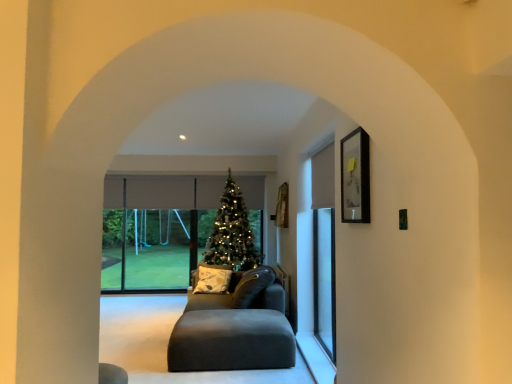
Question: In terms of height, does matte black picture frame at upper right look taller or shorter compared to matte gray couch at center?

Choices:
 (A) short
 (B) tall

Answer: (A)

Question: Looking at the image, does matte black picture frame at upper right seem bigger or smaller compared to matte gray couch at center?

Choices:
 (A) small
 (B) big

Answer: (A)

Question: Estimate the real-world distances between objects in this image. Which object is farther from the clear glass screen door at right?

Choices:
 (A) matte black ottoman at center
 (B) green matte christmas tree at center
 (C) matte black picture frame at upper right
 (D) matte gray couch at center
 (E) yellow-green printed cushion at center

Answer: (C)

Question: Which of these objects is positioned closest to the matte black picture frame at upper right?

Choices:
 (A) clear glass screen door at right
 (B) yellow-green printed cushion at center
 (C) green matte christmas tree at center
 (D) matte black ottoman at center
 (E) matte gray couch at center

Answer: (A)